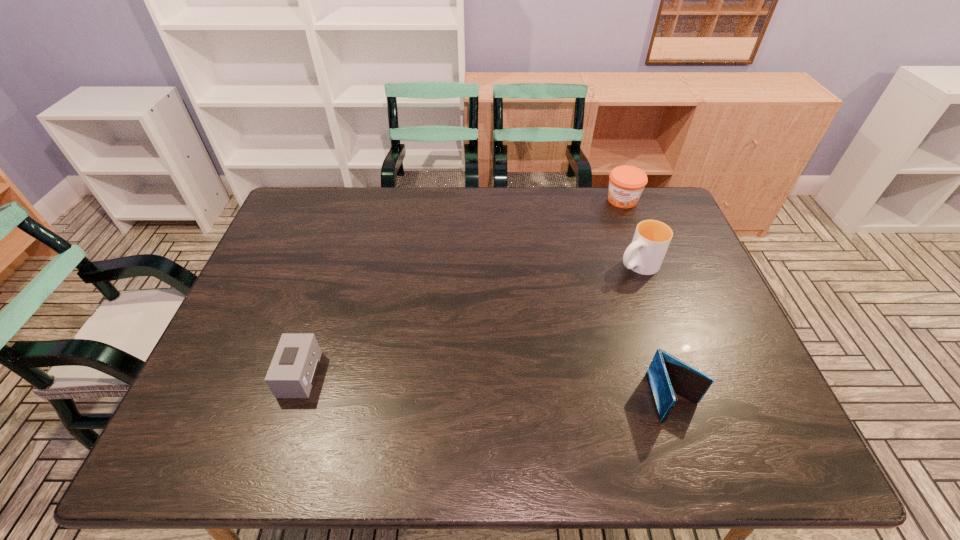
Where is `vacant point located between the cup and the shortest object`? This screenshot has width=960, height=540. vacant point located between the cup and the shortest object is located at coordinates (468, 320).

At what (x,y) coordinates should I click in order to perform the action: click on free space between the leftmost object and the wallet. Please return your answer as a coordinate pair (x, y). This screenshot has width=960, height=540. Looking at the image, I should click on (488, 386).

Find the location of `free area in between the jam and the wallet`. free area in between the jam and the wallet is located at coordinates (648, 299).

Image resolution: width=960 pixels, height=540 pixels. I want to click on vacant area that lies between the shortest object and the jam, so pos(462,287).

The width and height of the screenshot is (960, 540). Find the location of `free spot between the farthest object and the alarm clock`. free spot between the farthest object and the alarm clock is located at coordinates (462, 287).

This screenshot has width=960, height=540. What are the coordinates of `vacant space that's between the jam and the cup` in the screenshot? It's located at (630, 232).

This screenshot has width=960, height=540. In order to click on free space between the farthest object and the shortest object in this screenshot , I will do `click(462, 287)`.

Image resolution: width=960 pixels, height=540 pixels. In order to click on free space between the farthest object and the alarm clock in this screenshot , I will do `click(462, 287)`.

Find the location of `free area in between the farthest object and the wallet`. free area in between the farthest object and the wallet is located at coordinates (648, 299).

Find the location of a particular element. The image size is (960, 540). object that is the nearest to the farthest object is located at coordinates (645, 254).